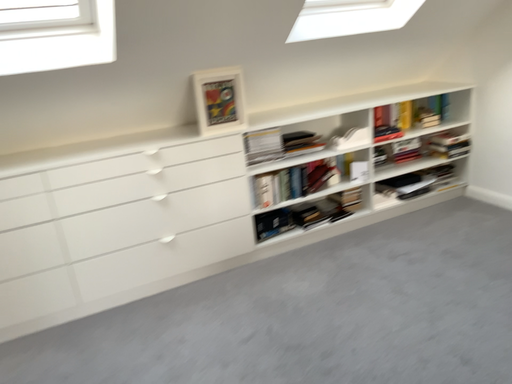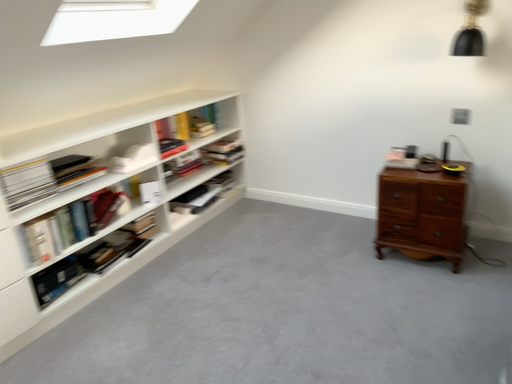
Question: How did the camera likely rotate when shooting the video?

Choices:
 (A) rotated left
 (B) rotated right

Answer: (B)